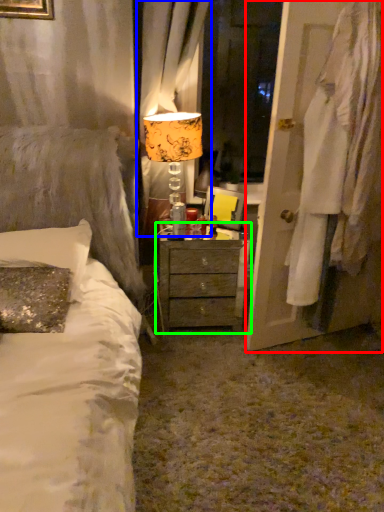
Question: Based on their relative distances, which object is farther from door (highlighted by a red box)? Choose from curtain (highlighted by a blue box) and nightstand (highlighted by a green box).

Choices:
 (A) curtain
 (B) nightstand

Answer: (A)